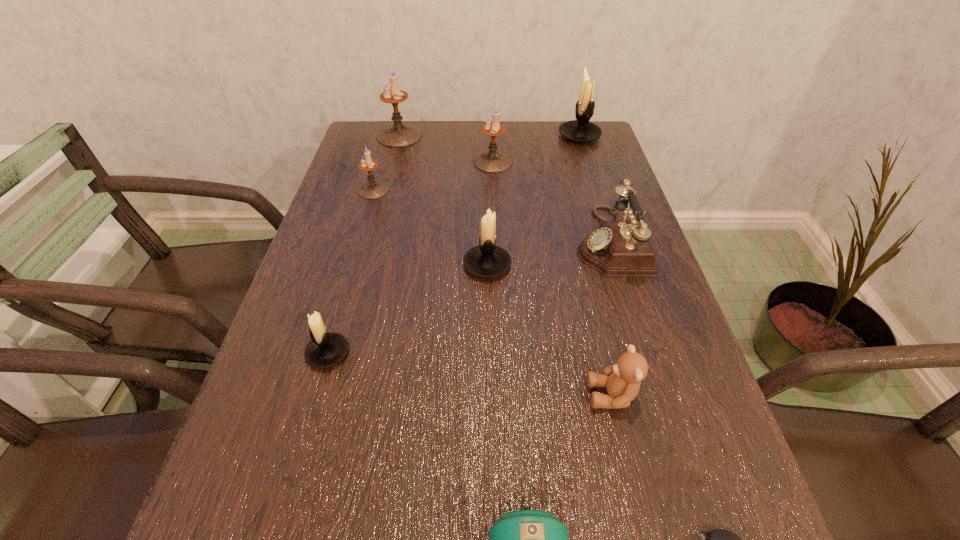
Locate an element on the screen. This screenshot has height=540, width=960. empty space between the smallest white candle holder and the rightmost white candle holder is located at coordinates (454, 245).

The width and height of the screenshot is (960, 540). Identify the location of empty location between the seventh farthest object and the second white candle holder from left to right. (408, 309).

At what (x,y) coordinates should I click in order to perform the action: click on blank region between the farthest purple candle holder and the black telephone. Please return your answer as a coordinate pair (x, y). Looking at the image, I should click on (505, 188).

Identify which object is located as the fifth nearest to the computer mouse. Please provide its 2D coordinates. Your answer should be formatted as a tuple, i.e. [(x, y)], where the tuple contains the x and y coordinates of a point satisfying the conditions above.

[(325, 350)]

Where is `object that is the fourth closest one to the biggest purple candle holder`? object that is the fourth closest one to the biggest purple candle holder is located at coordinates (486, 260).

Choose which candle holder is the fourth nearest neighbor to the biggest purple candle holder. Please provide its 2D coordinates. Your answer should be formatted as a tuple, i.e. [(x, y)], where the tuple contains the x and y coordinates of a point satisfying the conditions above.

[(486, 260)]

Find the location of `candle holder identified as the sixth closest to the blue alarm clock`. candle holder identified as the sixth closest to the blue alarm clock is located at coordinates (398, 134).

Point out which purple candle holder is positioned as the second nearest to the black telephone. Please provide its 2D coordinates. Your answer should be formatted as a tuple, i.e. [(x, y)], where the tuple contains the x and y coordinates of a point satisfying the conditions above.

[(372, 189)]

Where is `the second closest purple candle holder to the farthest purple candle holder`? Image resolution: width=960 pixels, height=540 pixels. the second closest purple candle holder to the farthest purple candle holder is located at coordinates (372, 189).

I want to click on white candle holder that is the third closest to the farthest purple candle holder, so tap(325, 350).